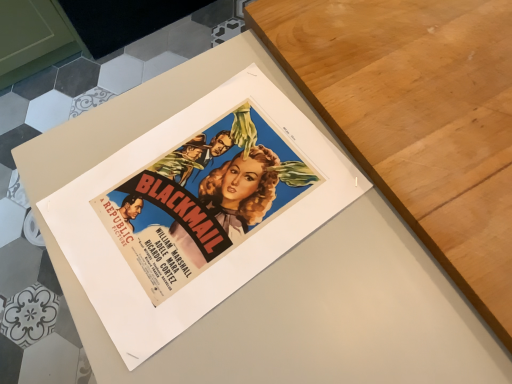
At what (x,y) coordinates should I click in order to perform the action: click on vacant space situated above matte paper poster at center (from a real-world perspective). Please return your answer as a coordinate pair (x, y). Looking at the image, I should click on (364, 172).